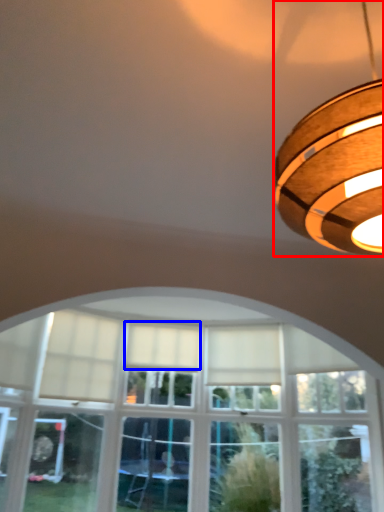
Question: Which object is closer to the camera taking this photo, lamp (highlighted by a red box) or curtain (highlighted by a blue box)?

Choices:
 (A) lamp
 (B) curtain

Answer: (A)